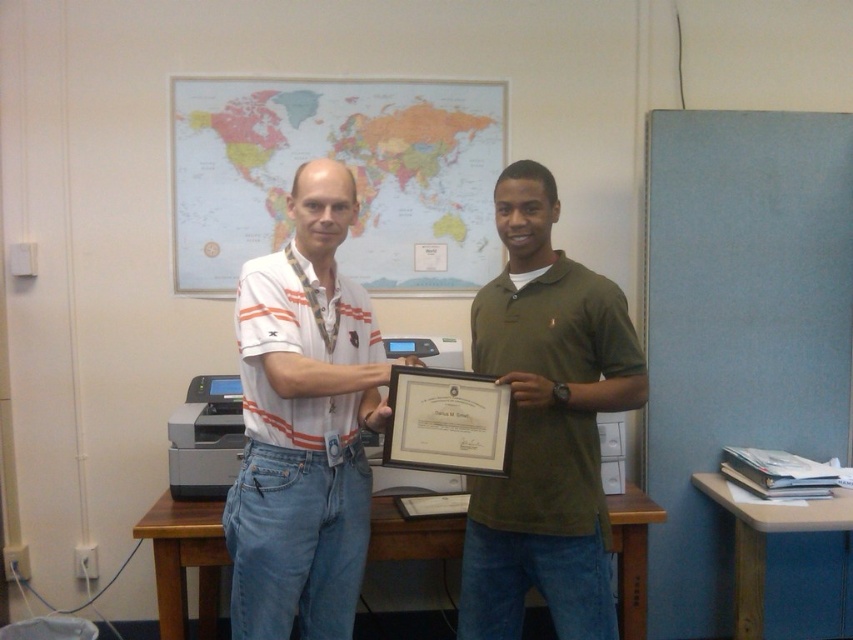
Question: Is white striped polo shirt at center to the right of green matte shirt at center from the viewer's perspective?

Choices:
 (A) yes
 (B) no

Answer: (B)

Question: Among these objects, which one is farthest from the camera?

Choices:
 (A) green matte shirt at center
 (B) white striped polo shirt at center

Answer: (A)

Question: Does white striped polo shirt at center appear on the right side of green matte shirt at center?

Choices:
 (A) yes
 (B) no

Answer: (B)

Question: Considering the relative positions of white striped polo shirt at center and green matte shirt at center in the image provided, where is white striped polo shirt at center located with respect to green matte shirt at center?

Choices:
 (A) right
 (B) left

Answer: (B)